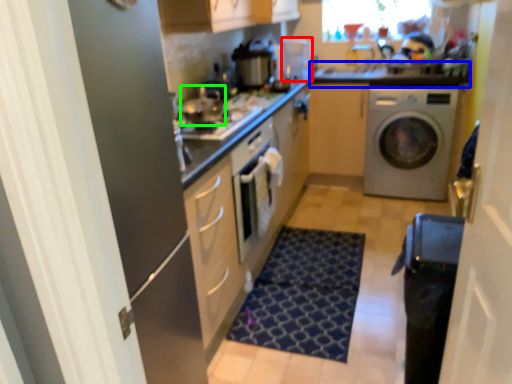
Question: Based on their relative distances, which object is farther from coffee machine (highlighted by a red box)? Choose from counter top (highlighted by a blue box) and appliance (highlighted by a green box).

Choices:
 (A) counter top
 (B) appliance

Answer: (B)